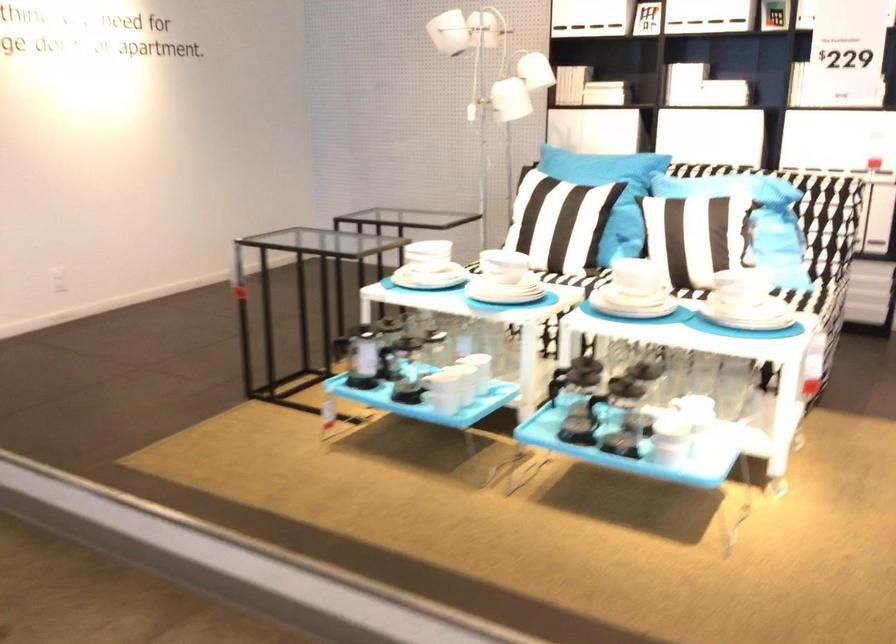
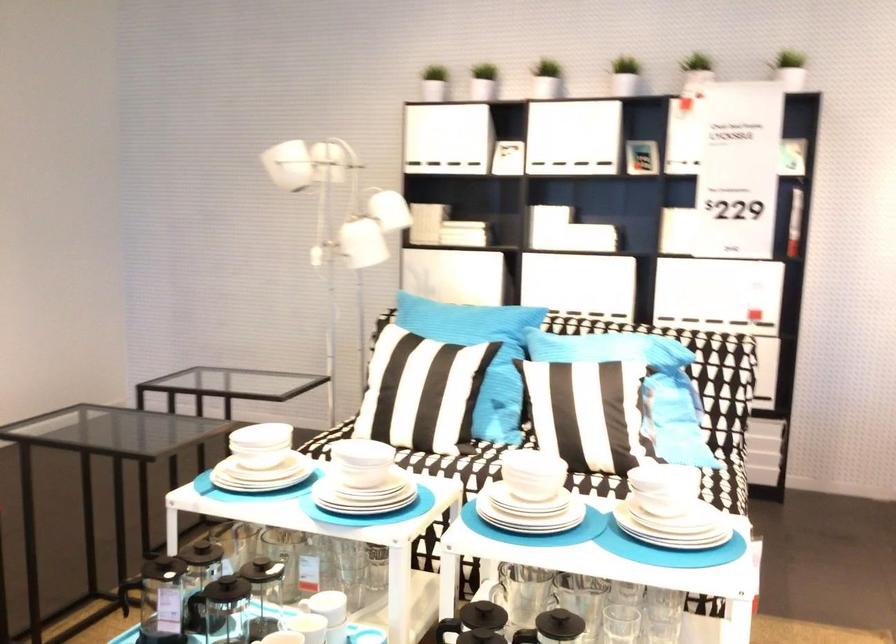
In the second image, find the point that corresponds to pixel 636 269 in the first image.

(531, 474)